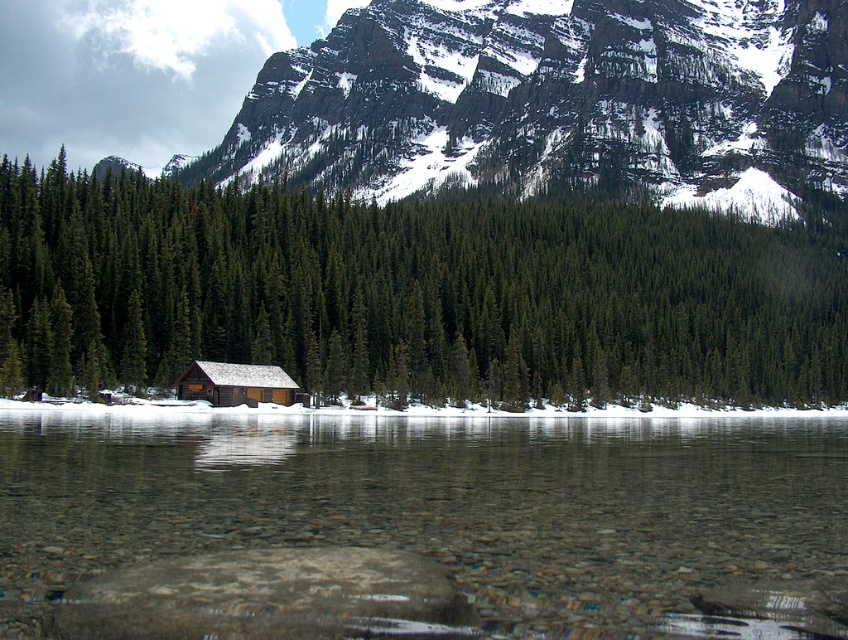
Question: Is green matte tree at center above wooden cabin at center?

Choices:
 (A) no
 (B) yes

Answer: (B)

Question: Can you confirm if clear glass water at center is smaller than wooden cabin at center?

Choices:
 (A) no
 (B) yes

Answer: (A)

Question: Does green matte tree at center appear on the left side of clear glass water at center?

Choices:
 (A) yes
 (B) no

Answer: (A)

Question: Which of these objects is positioned farthest from the wooden cabin at center?

Choices:
 (A) green matte tree at center
 (B) clear glass water at center

Answer: (A)

Question: Which of the following is the farthest from the observer?

Choices:
 (A) green matte tree at center
 (B) wooden cabin at center
 (C) clear glass water at center

Answer: (B)

Question: Which point is closer to the camera taking this photo?

Choices:
 (A) click(285, 403)
 (B) click(534, 211)
 (C) click(153, 445)

Answer: (C)